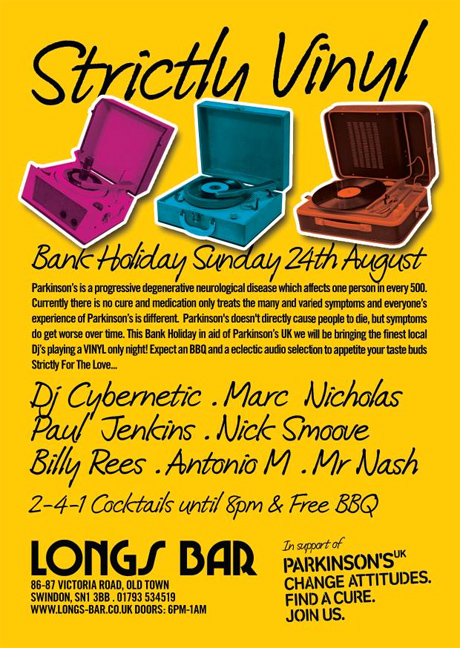
Find the location of `turquoise tinted record player`. turquoise tinted record player is located at coordinates 162,203.